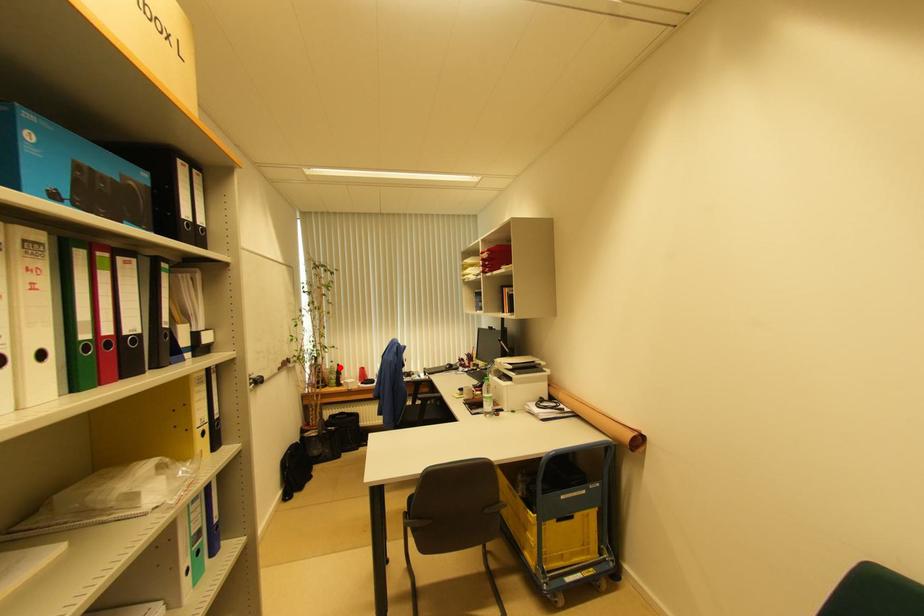
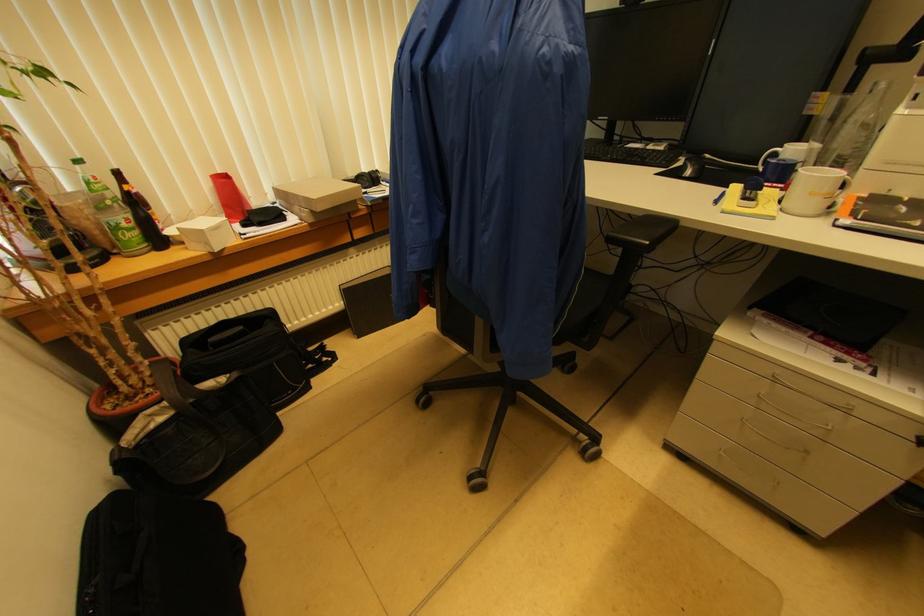
Where in the second image is the point corresponding to the highlighted location from the first image?

(118, 176)